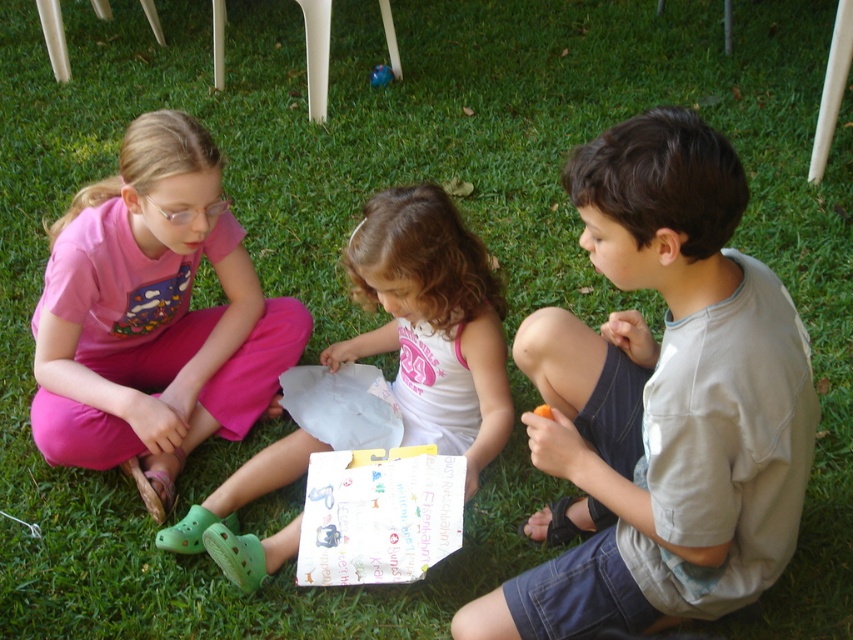
Question: Considering the relative positions of light gray cotton shirt at center and pink fabric dress at center in the image provided, where is light gray cotton shirt at center located with respect to pink fabric dress at center?

Choices:
 (A) above
 (B) below

Answer: (A)

Question: Estimate the real-world distances between objects in this image. Which object is closer to the pink fabric dress at center?

Choices:
 (A) light gray cotton shirt at center
 (B) pink cotton shirt at left

Answer: (B)

Question: Does pink cotton shirt at left lie behind pink fabric dress at center?

Choices:
 (A) yes
 (B) no

Answer: (A)

Question: Which point is closer to the camera?

Choices:
 (A) (132, 305)
 (B) (497, 406)
 (C) (645, 598)

Answer: (C)

Question: Which object is farther from the camera taking this photo?

Choices:
 (A) pink fabric dress at center
 (B) light gray cotton shirt at center

Answer: (A)

Question: Observing the image, what is the correct spatial positioning of pink cotton shirt at left in reference to pink fabric dress at center?

Choices:
 (A) above
 (B) below

Answer: (A)